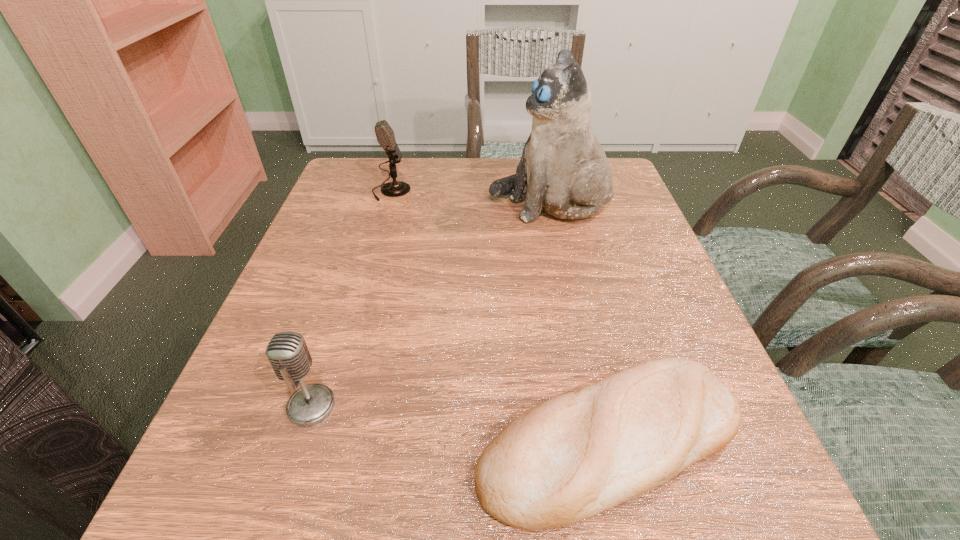
At what (x,y) coordinates should I click in order to perform the action: click on vacant space situated on the left of the shortest object. Please return your answer as a coordinate pair (x, y). Looking at the image, I should click on (240, 441).

Identify the location of cat present at the far edge. (563, 169).

You are a GUI agent. You are given a task and a screenshot of the screen. Output one action in this format:
    pyautogui.click(x=<x>, y=<y>)
    Task: Click on the microphone situated at the far edge
    
    Given the screenshot: What is the action you would take?
    point(385,136)

Image resolution: width=960 pixels, height=540 pixels. What are the coordinates of `object positioned at the near edge` in the screenshot? It's located at (569, 458).

Locate an element on the screen. cat that is positioned at the right edge is located at coordinates (563, 169).

At what (x,y) coordinates should I click in order to perform the action: click on bread at the right edge. Please return your answer as a coordinate pair (x, y). Looking at the image, I should click on (569, 458).

This screenshot has width=960, height=540. I want to click on object that is at the far left corner, so click(385, 136).

I want to click on object that is at the far right corner, so click(563, 169).

Where is `object situated at the near right corner`? object situated at the near right corner is located at coordinates (569, 458).

The height and width of the screenshot is (540, 960). Find the location of `free region at the far edge of the desktop`. free region at the far edge of the desktop is located at coordinates (475, 173).